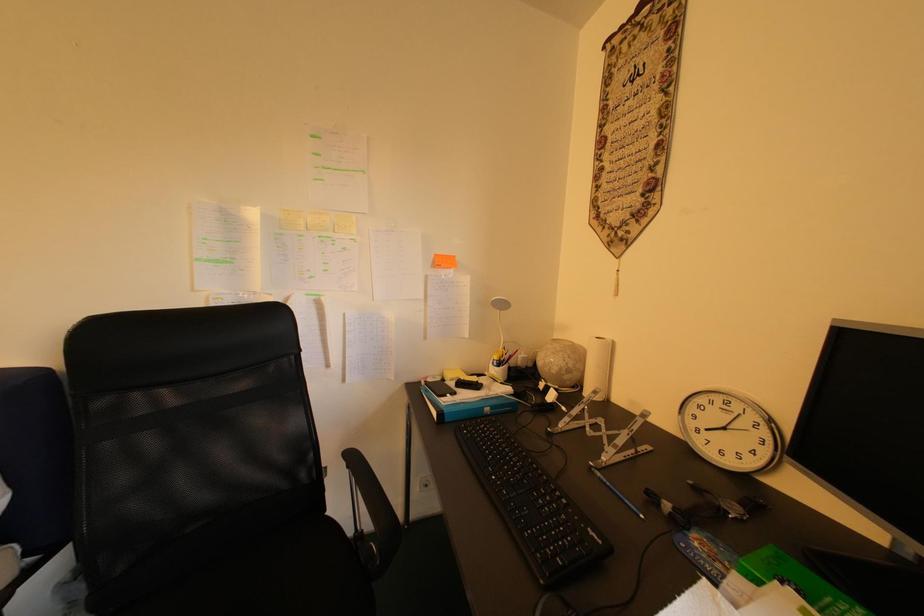
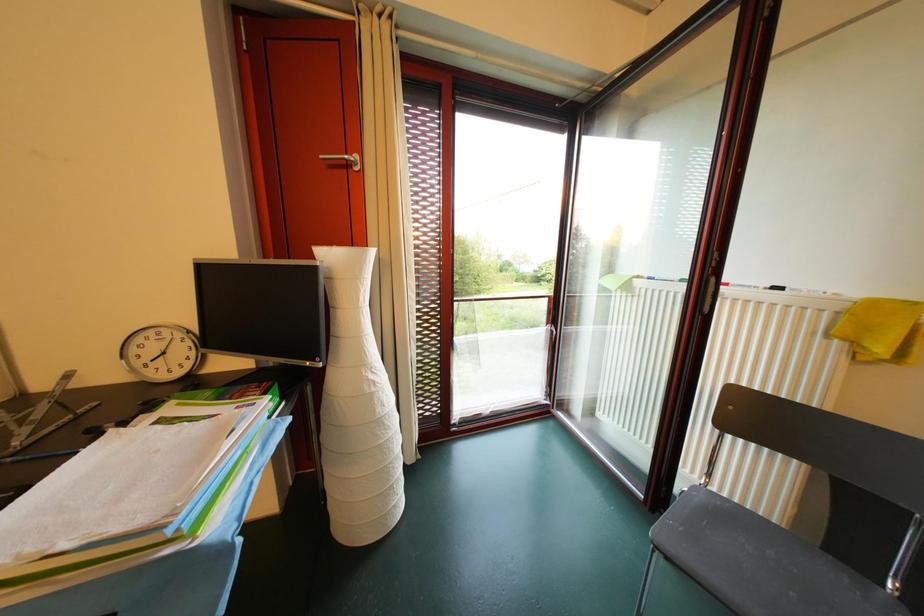
Question: How did the camera likely rotate?

Choices:
 (A) Left
 (B) Right
 (C) Up
 (D) Down

Answer: (B)